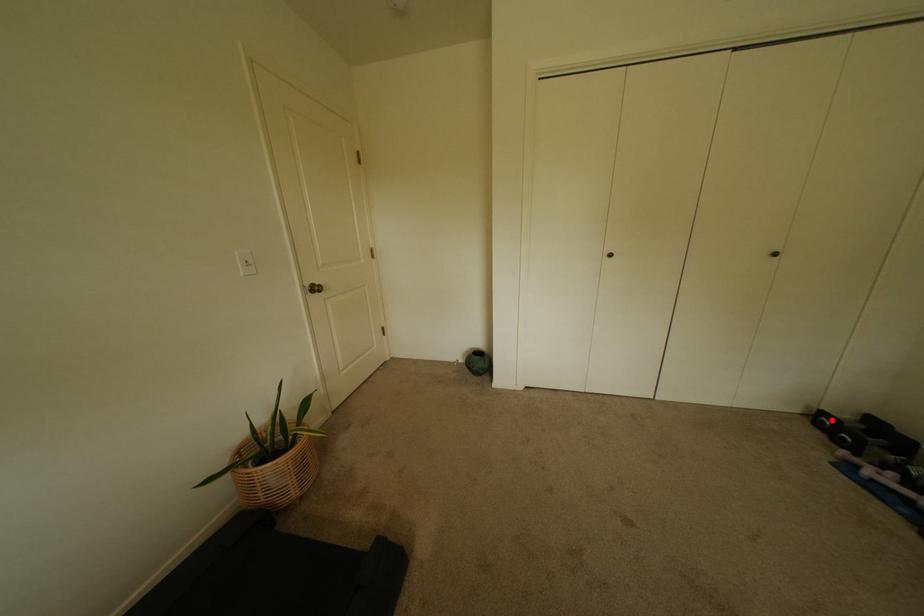
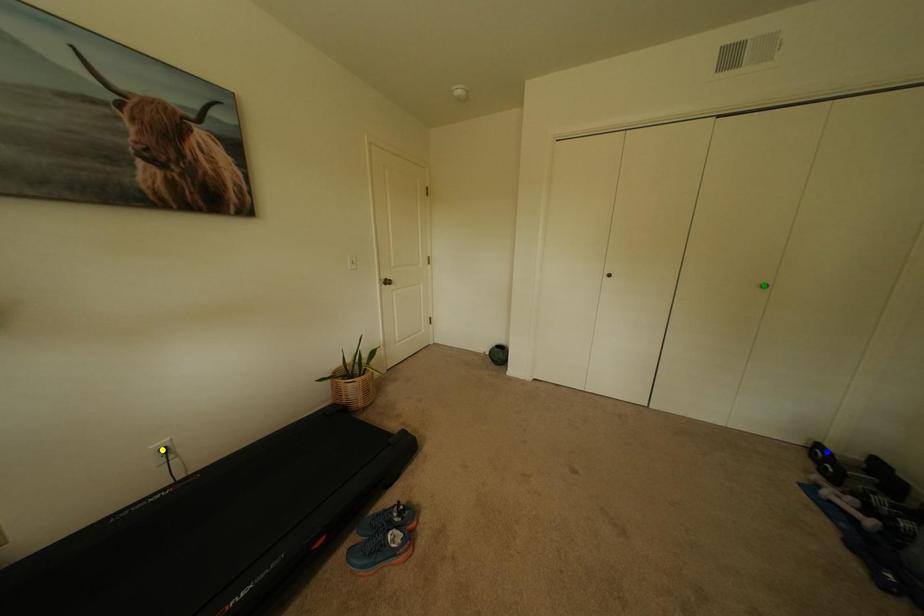
Question: I am providing you with two images of the same scene from different viewpoints. A red point is marked on the first image. You are given multiple points on the second image. Which point in image 2 represents the same 3d spot as the red point in image 1?

Choices:
 (A) yellow point
 (B) blue point
 (C) green point

Answer: (B)